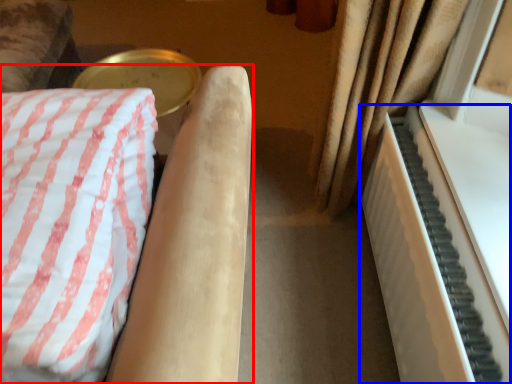
Question: Among these objects, which one is nearest to the camera, furniture (highlighted by a red box) or piano (highlighted by a blue box)?

Choices:
 (A) furniture
 (B) piano

Answer: (A)